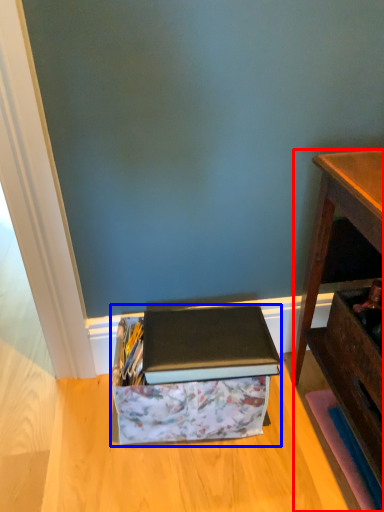
Question: Which object is closer to the camera taking this photo, desk (highlighted by a red box) or storage box (highlighted by a blue box)?

Choices:
 (A) desk
 (B) storage box

Answer: (A)